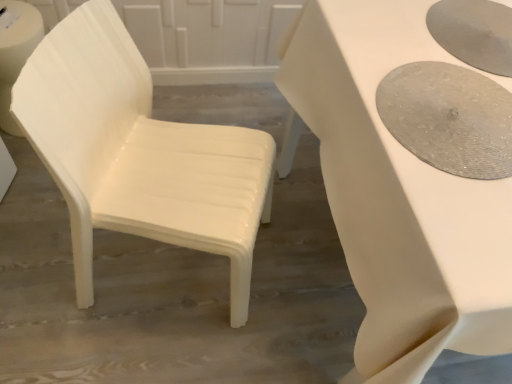
Question: Considering the relative sizes of white glossy table at center and matte silver tray at right in the image provided, is white glossy table at center smaller than matte silver tray at right?

Choices:
 (A) yes
 (B) no

Answer: (B)

Question: Does white glossy table at center have a lesser height compared to matte silver tray at right?

Choices:
 (A) yes
 (B) no

Answer: (B)

Question: From a real-world perspective, does white glossy table at center stand above matte silver tray at right?

Choices:
 (A) yes
 (B) no

Answer: (B)

Question: From a real-world perspective, is white glossy table at center located beneath matte silver tray at right?

Choices:
 (A) no
 (B) yes

Answer: (B)

Question: Is white glossy table at center with matte silver tray at right?

Choices:
 (A) yes
 (B) no

Answer: (B)

Question: Does point (388, 82) appear closer or farther from the camera than point (396, 218)?

Choices:
 (A) farther
 (B) closer

Answer: (A)

Question: Looking at the image, does matte silver tray at right seem bigger or smaller compared to white glossy table at center?

Choices:
 (A) small
 (B) big

Answer: (A)

Question: From the image's perspective, is matte silver tray at right above or below white glossy table at center?

Choices:
 (A) below
 (B) above

Answer: (B)

Question: Choose the correct answer: Is matte silver tray at right inside white glossy table at center or outside it?

Choices:
 (A) outside
 (B) inside

Answer: (B)

Question: From the image's perspective, relative to white plastic chair at left, is white glossy table at center above or below?

Choices:
 (A) below
 (B) above

Answer: (B)

Question: Is white glossy table at center spatially inside white plastic chair at left, or outside of it?

Choices:
 (A) outside
 (B) inside

Answer: (A)

Question: Looking at their shapes, would you say white glossy table at center is wider or thinner than white plastic chair at left?

Choices:
 (A) wide
 (B) thin

Answer: (A)

Question: Based on their sizes in the image, would you say white glossy table at center is bigger or smaller than white plastic chair at left?

Choices:
 (A) small
 (B) big

Answer: (B)

Question: Considering the positions of point (166, 205) and point (476, 198), is point (166, 205) closer or farther from the camera than point (476, 198)?

Choices:
 (A) farther
 (B) closer

Answer: (A)

Question: Considering the relative positions of white plastic chair at left and white glossy table at center in the image provided, is white plastic chair at left to the left or to the right of white glossy table at center?

Choices:
 (A) right
 (B) left

Answer: (B)